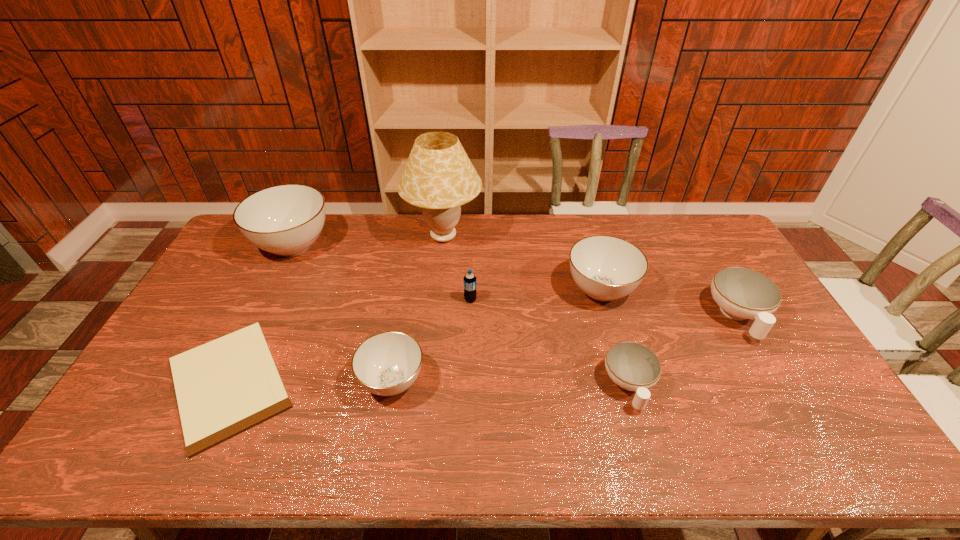
I want to click on free space located 0.110m on the side with the handle of the left white chinaware, so click(650, 458).

Identify the location of free space located 0.200m on the right of the shortest object. The height and width of the screenshot is (540, 960). (375, 383).

You are a GUI agent. You are given a task and a screenshot of the screen. Output one action in this format:
    pyautogui.click(x=<x>, y=<y>)
    Task: Click on the lampshade that is at the far edge
    
    Given the screenshot: What is the action you would take?
    pyautogui.click(x=439, y=177)

The width and height of the screenshot is (960, 540). What are the coordinates of `chinaware that is at the far edge` in the screenshot? It's located at (286, 220).

Locate an element on the screen. This screenshot has width=960, height=540. object at the near edge is located at coordinates (224, 387).

Where is `chinaware that is at the left edge`? This screenshot has height=540, width=960. chinaware that is at the left edge is located at coordinates (286, 220).

I want to click on clipboard that is at the left edge, so click(x=224, y=387).

Where is `object positioned at the right edge`? object positioned at the right edge is located at coordinates (742, 293).

This screenshot has width=960, height=540. Find the location of `object located in the far left corner section of the desktop`. object located in the far left corner section of the desktop is located at coordinates (286, 220).

The image size is (960, 540). What are the coordinates of `object at the near left corner` in the screenshot? It's located at (224, 387).